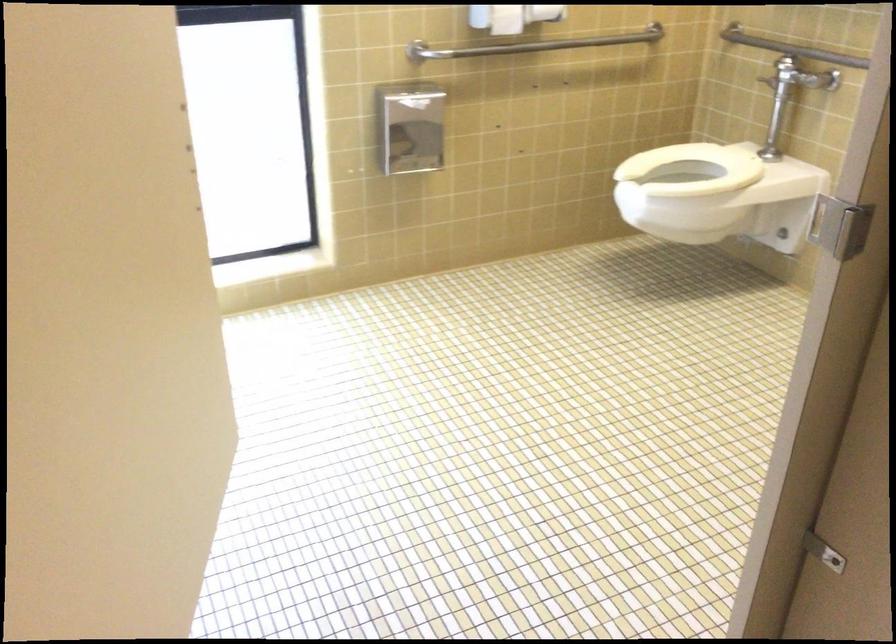
You are a GUI agent. You are given a task and a screenshot of the screen. Output one action in this format:
    pyautogui.click(x=<x>, y=<y>)
    Task: Click on the toilet paper roll
    The image size is (896, 644).
    Given the screenshot: What is the action you would take?
    pyautogui.click(x=506, y=20)